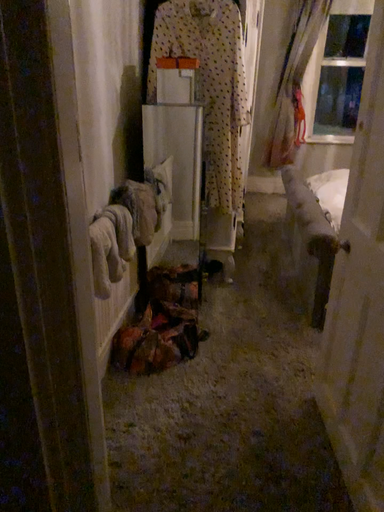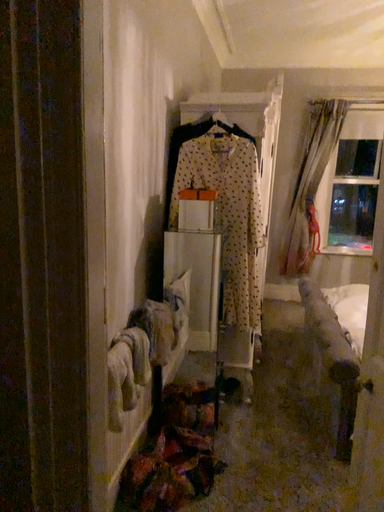
Question: How did the camera likely rotate when shooting the video?

Choices:
 (A) rotated downward
 (B) rotated upward

Answer: (B)